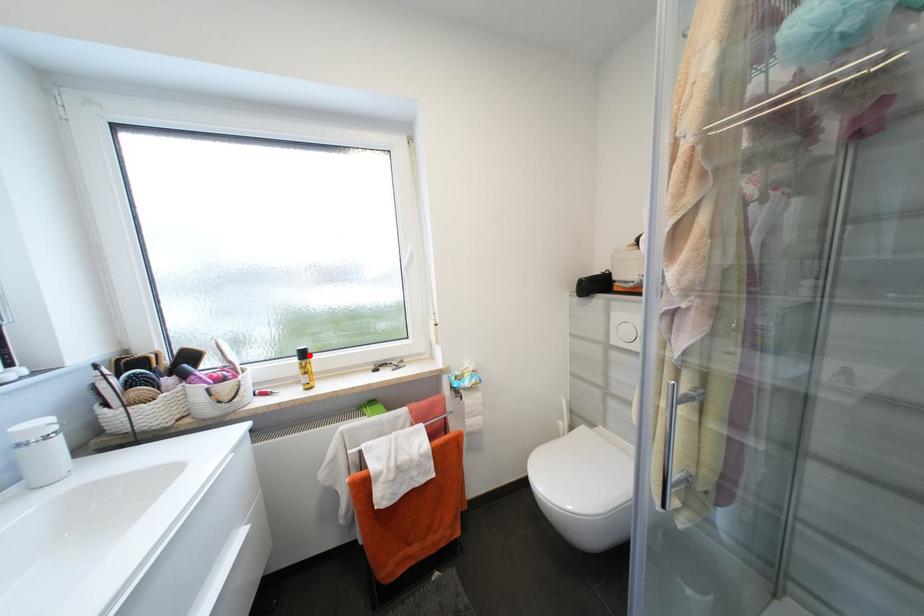
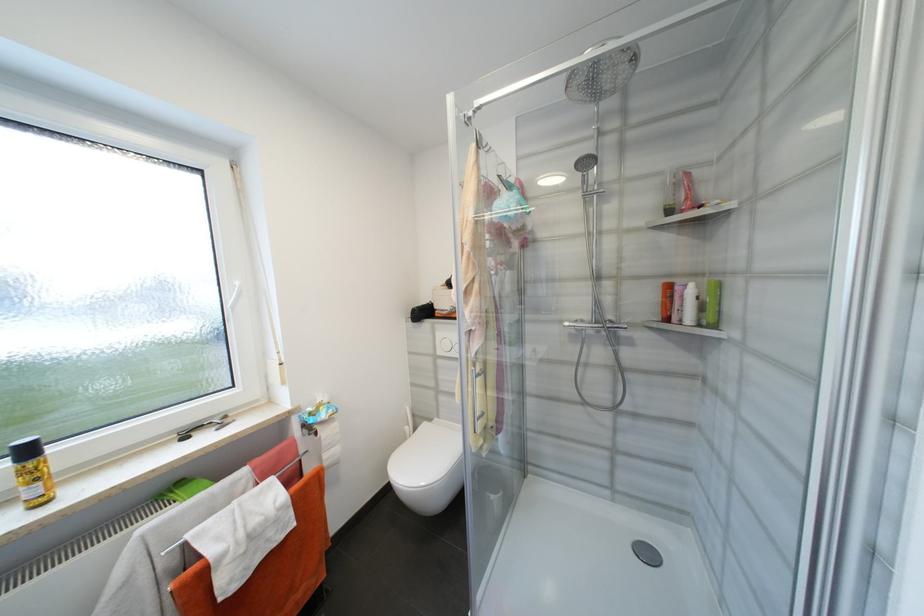
Find the pixel in the second image that matches the highlighted location in the first image.

(33, 453)